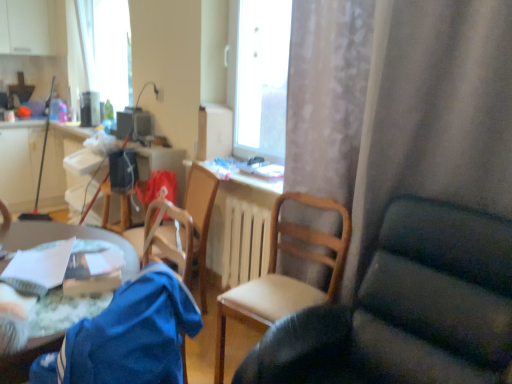
Question: Is wooden radiator at center shorter than matte plastic computer desk at left?

Choices:
 (A) no
 (B) yes

Answer: (B)

Question: Considering the relative sizes of wooden radiator at center and matte plastic computer desk at left in the image provided, is wooden radiator at center thinner than matte plastic computer desk at left?

Choices:
 (A) no
 (B) yes

Answer: (B)

Question: From a real-world perspective, does wooden radiator at center sit lower than matte plastic computer desk at left?

Choices:
 (A) yes
 (B) no

Answer: (A)

Question: Is wooden radiator at center taller than matte plastic computer desk at left?

Choices:
 (A) yes
 (B) no

Answer: (B)

Question: Does wooden radiator at center have a greater width compared to matte plastic computer desk at left?

Choices:
 (A) no
 (B) yes

Answer: (A)

Question: Is wooden chair at center, which is the third chair from left to right, wider or thinner than green fabric table at lower left?

Choices:
 (A) wide
 (B) thin

Answer: (A)

Question: Would you say wooden chair at center, which is the third chair from left to right, is inside or outside green fabric table at lower left?

Choices:
 (A) outside
 (B) inside

Answer: (A)

Question: Is wooden chair at center, which is the third chair from left to right, taller or shorter than green fabric table at lower left?

Choices:
 (A) tall
 (B) short

Answer: (A)

Question: In the image, is wooden chair at center, which is the third chair from left to right, on the left side or the right side of green fabric table at lower left?

Choices:
 (A) right
 (B) left

Answer: (A)

Question: Would you say wooden chair at center is to the left or to the right of wooden radiator at center in the picture?

Choices:
 (A) left
 (B) right

Answer: (A)

Question: From their relative heights in the image, would you say wooden chair at center is taller or shorter than wooden radiator at center?

Choices:
 (A) tall
 (B) short

Answer: (B)

Question: In terms of size, does wooden chair at center appear bigger or smaller than wooden radiator at center?

Choices:
 (A) small
 (B) big

Answer: (A)

Question: In terms of width, does wooden chair at center look wider or thinner when compared to wooden radiator at center?

Choices:
 (A) wide
 (B) thin

Answer: (A)

Question: From the image's perspective, is wooden chair at center positioned above or below matte plastic computer desk at left?

Choices:
 (A) above
 (B) below

Answer: (B)

Question: In terms of size, does wooden chair at center appear bigger or smaller than matte plastic computer desk at left?

Choices:
 (A) big
 (B) small

Answer: (B)